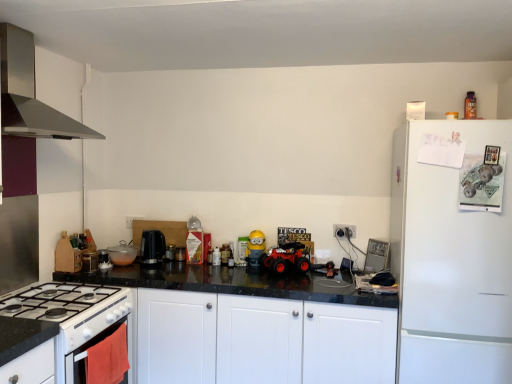
Question: Relative to metallic black kettle at center, which is the 1th appliance from right to left, is white glossy oven at lower left in front or behind?

Choices:
 (A) behind
 (B) front

Answer: (B)

Question: From a real-world perspective, is white glossy oven at lower left above or below metallic black kettle at center, which is the 2th appliance in left-to-right order?

Choices:
 (A) above
 (B) below

Answer: (B)

Question: Which is nearer to the white matte refrigerator at right?

Choices:
 (A) black plastic coffee machine at center
 (B) black granite countertop at center
 (C) stainless steel range hood at upper left, which is the 1th kitchen appliance in top-to-bottom order
 (D) metallic black kettle at center, which is the 2th appliance in left-to-right order
 (E) yellow matte minion at center

Answer: (B)

Question: Based on their relative distances, which object is farther from the matte red plastic toy car at center?

Choices:
 (A) black plastic coffee machine at center
 (B) yellow matte minion at center
 (C) white glossy oven at lower left
 (D) black granite countertop at center
 (E) white glossy gas stove at lower left

Answer: (E)